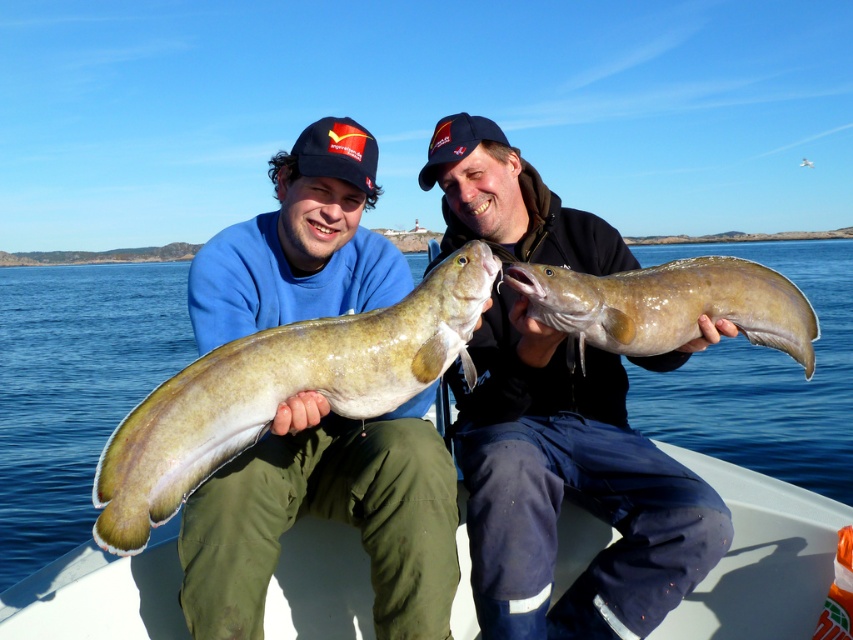
Question: Based on their relative distances, which object is nearer to the greenish-yellow rubber fish at center?

Choices:
 (A) brown leather fish at center
 (B) smooth yellowish fish at center
 (C) white plastic boat at lower center

Answer: (B)

Question: Does greenish-yellow rubber fish at center appear under brown leather fish at center?

Choices:
 (A) no
 (B) yes

Answer: (B)

Question: Estimate the real-world distances between objects in this image. Which object is closer to the smooth yellowish fish at center?

Choices:
 (A) white plastic boat at lower center
 (B) greenish-yellow rubber fish at center

Answer: (B)

Question: Is white plastic boat at lower center wider than greenish-yellow rubber fish at center?

Choices:
 (A) no
 (B) yes

Answer: (A)

Question: Is white plastic boat at lower center below brown leather fish at center?

Choices:
 (A) no
 (B) yes

Answer: (B)

Question: Which point is closer to the camera?

Choices:
 (A) white plastic boat at lower center
 (B) greenish-yellow rubber fish at center
 (C) brown leather fish at center

Answer: (B)